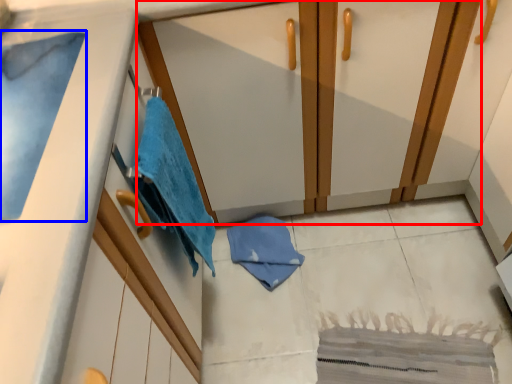
Question: Which object appears farthest to the camera in this image, dresser (highlighted by a red box) or bath towel (highlighted by a blue box)?

Choices:
 (A) dresser
 (B) bath towel

Answer: (A)